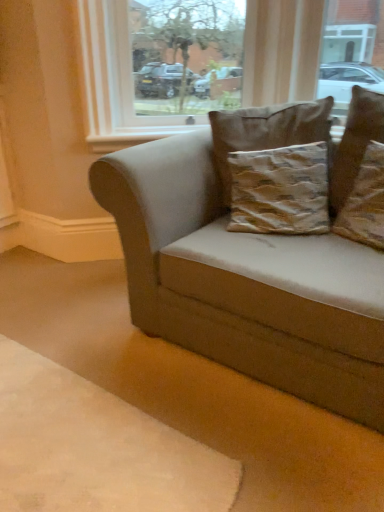
Question: Considering the relative sizes of brown textured cushion at center, which is the first pillow from left to right, and brown textured pillow at upper right, which ranks as the 1th pillow in right-to-left order, in the image provided, is brown textured cushion at center, which is the first pillow from left to right, wider than brown textured pillow at upper right, which ranks as the 1th pillow in right-to-left order,?

Choices:
 (A) no
 (B) yes

Answer: (B)

Question: Can you confirm if brown textured cushion at center, which is the third pillow in right-to-left order, is shorter than brown textured pillow at upper right, which ranks as the 1th pillow in right-to-left order?

Choices:
 (A) yes
 (B) no

Answer: (B)

Question: Considering the relative sizes of brown textured cushion at center, which is the first pillow from left to right, and brown textured pillow at upper right, which ranks as the 1th pillow in right-to-left order, in the image provided, is brown textured cushion at center, which is the first pillow from left to right, thinner than brown textured pillow at upper right, which ranks as the 1th pillow in right-to-left order,?

Choices:
 (A) yes
 (B) no

Answer: (B)

Question: Does brown textured cushion at center, which is the first pillow from left to right, come in front of brown textured pillow at upper right, which ranks as the 1th pillow in right-to-left order?

Choices:
 (A) no
 (B) yes

Answer: (A)

Question: Would you say brown textured cushion at center, which is the first pillow from left to right, contains brown textured pillow at upper right, which is the third pillow from left to right?

Choices:
 (A) no
 (B) yes

Answer: (A)

Question: Are brown textured cushion at center, which is the third pillow in right-to-left order, and brown textured pillow at upper right, which ranks as the 1th pillow in right-to-left order, beside each other?

Choices:
 (A) no
 (B) yes

Answer: (A)

Question: Is suede beige couch at center shorter than beige fabric dog bed at lower right?

Choices:
 (A) yes
 (B) no

Answer: (B)

Question: Are suede beige couch at center and beige fabric dog bed at lower right beside each other?

Choices:
 (A) yes
 (B) no

Answer: (B)

Question: Are suede beige couch at center and beige fabric dog bed at lower right far apart?

Choices:
 (A) yes
 (B) no

Answer: (B)

Question: From the image's perspective, is suede beige couch at center on beige fabric dog bed at lower right?

Choices:
 (A) yes
 (B) no

Answer: (A)

Question: Is suede beige couch at center smaller than beige fabric dog bed at lower right?

Choices:
 (A) yes
 (B) no

Answer: (B)

Question: Is suede beige couch at center positioned before beige fabric dog bed at lower right?

Choices:
 (A) yes
 (B) no

Answer: (B)

Question: Does textured brown pillow at upper right, which is the 2th pillow in right-to-left order, lie in front of transparent glass window at upper center?

Choices:
 (A) no
 (B) yes

Answer: (B)